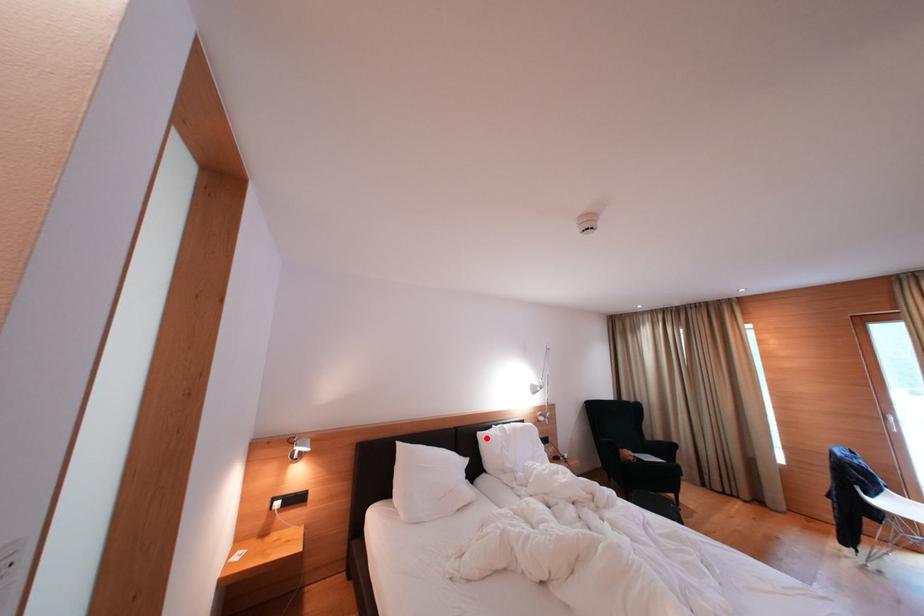
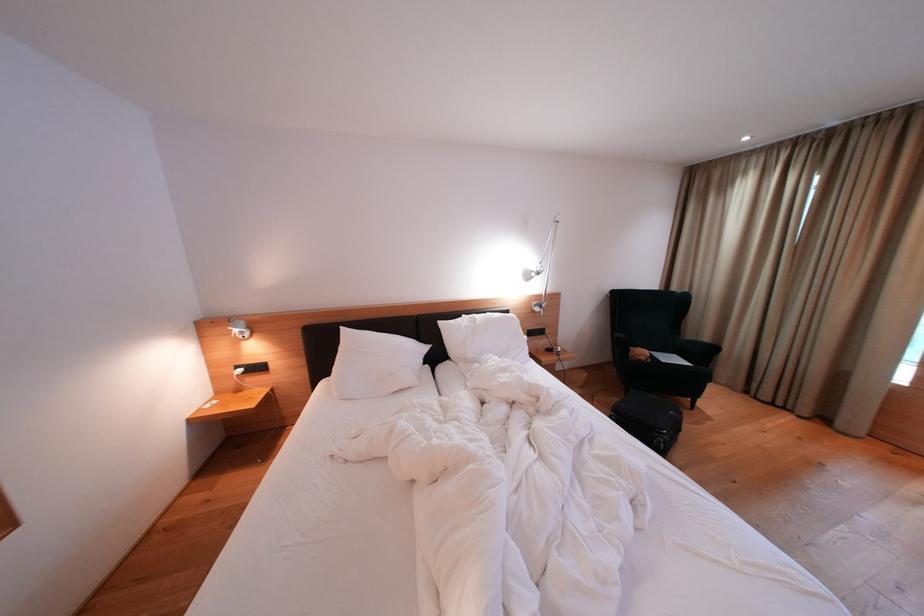
Locate, in the second image, the point that corresponds to the highlighted location in the first image.

(447, 328)